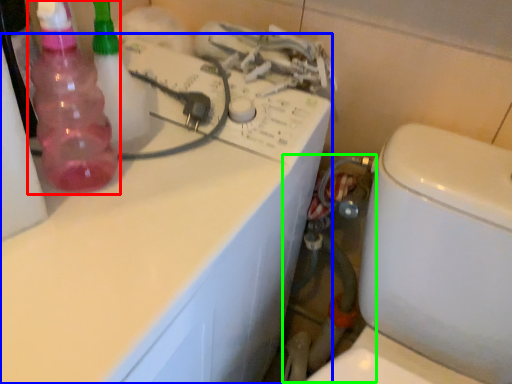
Question: Which is nearer to the bottle (highlighted by a red box)? counter top (highlighted by a blue box) or water pipe (highlighted by a green box).

Choices:
 (A) counter top
 (B) water pipe

Answer: (A)